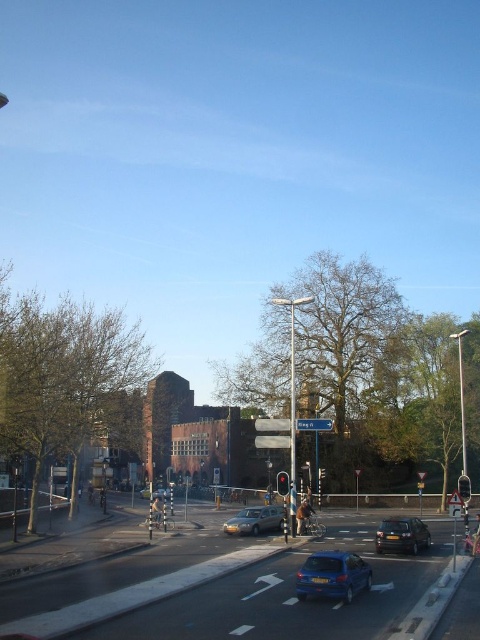
You are a delivery driver who needs to park your van near the blue metallic hatchback at center and the red glass traffic light at center. Which object should you park closer to if you want to minimize the space taken up by your van?

You should park closer to the blue metallic hatchback at center because it occupies less space than the red glass traffic light at center, so positioning your van near it would require less area.

You are a self driving car approaching the intersection in the image. You see the shiny black car at lower right. Based on its position, can you estimate whether it is on the left or right side of the road?

The shiny black car at lower right is positioned at point (402, 536) in the image. Since the coordinates are both 0.838, it is located near the lower right corner of the image, which corresponds to the right side of the road from the driver perspective. Therefore, the shiny black car at lower right is on the right side of the road.

You are a pedestrian standing at the crosswalk. You see a shiny black car at lower right. Can you safely cross the road before the shiny black car reaches your position?

The shiny black car at lower right is located at point (402,536), which is relatively close to the crosswalk. However, without information on the car speed or distance from the crosswalk, it is impossible to determine if it is safe to cross. Please wait for a safe opportunity.